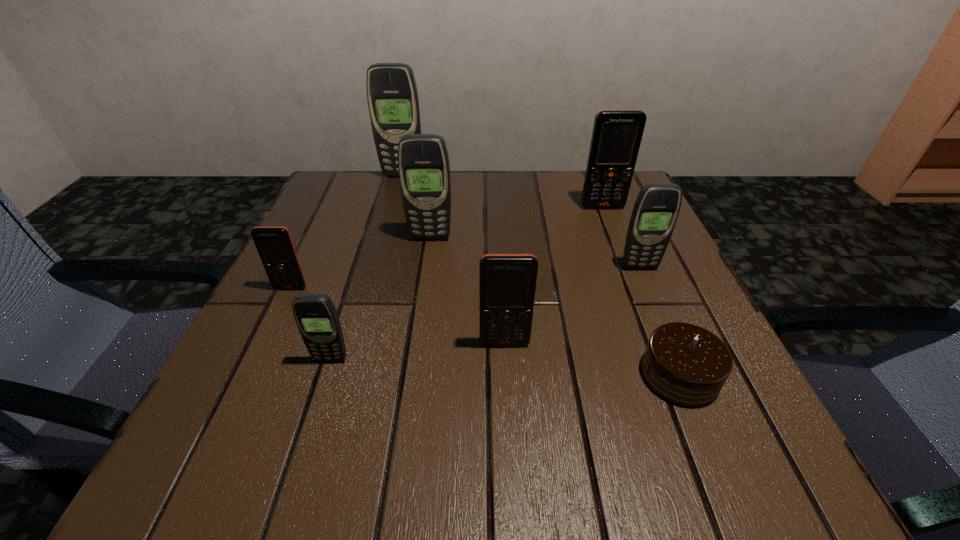
Identify the location of blank space located on the screen of the fifth cellular telephone from left to right. (510, 435).

Identify the location of blank space located 0.260m on the screen of the smallest orange cellular telephone. This screenshot has width=960, height=540. (228, 419).

You are a GUI agent. You are given a task and a screenshot of the screen. Output one action in this format:
    pyautogui.click(x=<x>, y=<y>)
    Task: Click on the vacant area situated 0.190m on the screen of the smallest gray cellular telephone
    
    Given the screenshot: What is the action you would take?
    pyautogui.click(x=290, y=488)

Where is `vacant space situated 0.230m on the back of the chocolate cake`? The width and height of the screenshot is (960, 540). vacant space situated 0.230m on the back of the chocolate cake is located at coordinates (631, 256).

Where is `chocolate cake present at the right edge`? The image size is (960, 540). chocolate cake present at the right edge is located at coordinates point(685,364).

Identify the location of object present at the far left corner. The image size is (960, 540). (392, 95).

I want to click on object at the far right corner, so click(x=617, y=134).

Image resolution: width=960 pixels, height=540 pixels. Identify the location of vacant area at the far edge of the desktop. (397, 203).

Image resolution: width=960 pixels, height=540 pixels. What are the coordinates of `free space at the left edge` in the screenshot? It's located at (337, 228).

Where is `vacant space at the right edge of the desktop`? This screenshot has height=540, width=960. vacant space at the right edge of the desktop is located at coordinates (720, 403).